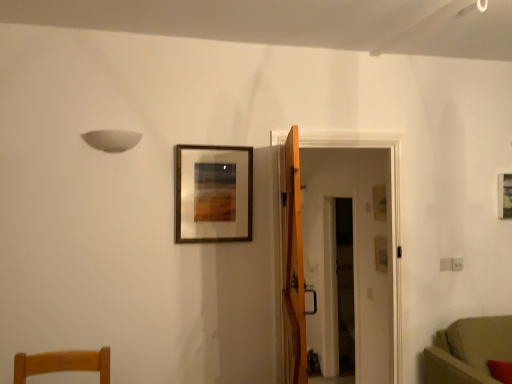
Question: Is transparent glass door at center positioned behind matte gold picture frame at upper right, placed as the third picture frame when sorted from front to back?

Choices:
 (A) no
 (B) yes

Answer: (B)

Question: Is transparent glass door at center looking in the opposite direction of matte gold picture frame at upper right, the second picture frame viewed from the right?

Choices:
 (A) yes
 (B) no

Answer: (B)

Question: Is transparent glass door at center wider than matte gold picture frame at upper right, placed as the third picture frame when sorted from front to back?

Choices:
 (A) no
 (B) yes

Answer: (B)

Question: Are transparent glass door at center and matte gold picture frame at upper right, placed as the third picture frame when sorted from front to back, beside each other?

Choices:
 (A) yes
 (B) no

Answer: (B)

Question: Considering the relative positions of transparent glass door at center and matte gold picture frame at upper right, the second picture frame positioned from the left, in the image provided, is transparent glass door at center to the left of matte gold picture frame at upper right, the second picture frame positioned from the left, from the viewer's perspective?

Choices:
 (A) yes
 (B) no

Answer: (A)

Question: Does point (471, 370) appear closer or farther from the camera than point (330, 292)?

Choices:
 (A) closer
 (B) farther

Answer: (A)

Question: Based on their sizes in the image, would you say suede-like beige sofa at lower right is bigger or smaller than transparent glass door at center?

Choices:
 (A) small
 (B) big

Answer: (A)

Question: From the image's perspective, relative to transparent glass door at center, is suede-like beige sofa at lower right above or below?

Choices:
 (A) below
 (B) above

Answer: (A)

Question: In terms of width, does suede-like beige sofa at lower right look wider or thinner when compared to transparent glass door at center?

Choices:
 (A) thin
 (B) wide

Answer: (B)

Question: From the image's perspective, is matte gold picture frame at upper right, the second picture frame positioned from the left, positioned above or below wooden-framed artwork at center, acting as the first picture frame starting from the left?

Choices:
 (A) below
 (B) above

Answer: (A)

Question: In terms of height, does matte gold picture frame at upper right, which is counted as the first picture frame, starting from the back, look taller or shorter compared to wooden-framed artwork at center, the 1th picture frame viewed from the front?

Choices:
 (A) tall
 (B) short

Answer: (B)

Question: Do you think matte gold picture frame at upper right, placed as the third picture frame when sorted from front to back, is within wooden-framed artwork at center, acting as the first picture frame starting from the left, or outside of it?

Choices:
 (A) outside
 (B) inside

Answer: (A)

Question: In terms of size, does matte gold picture frame at upper right, the second picture frame positioned from the left, appear bigger or smaller than wooden-framed artwork at center, which is counted as the third picture frame, starting from the right?

Choices:
 (A) small
 (B) big

Answer: (A)

Question: Looking at the image, does wooden picture frame at upper right, the 2th picture frame when ordered from front to back, seem bigger or smaller compared to wooden-framed artwork at center, placed as the third picture frame when sorted from back to front?

Choices:
 (A) big
 (B) small

Answer: (B)

Question: From a real-world perspective, relative to wooden-framed artwork at center, placed as the third picture frame when sorted from back to front, is wooden picture frame at upper right, which is the 2th picture frame in back-to-front order, vertically above or below?

Choices:
 (A) above
 (B) below

Answer: (B)